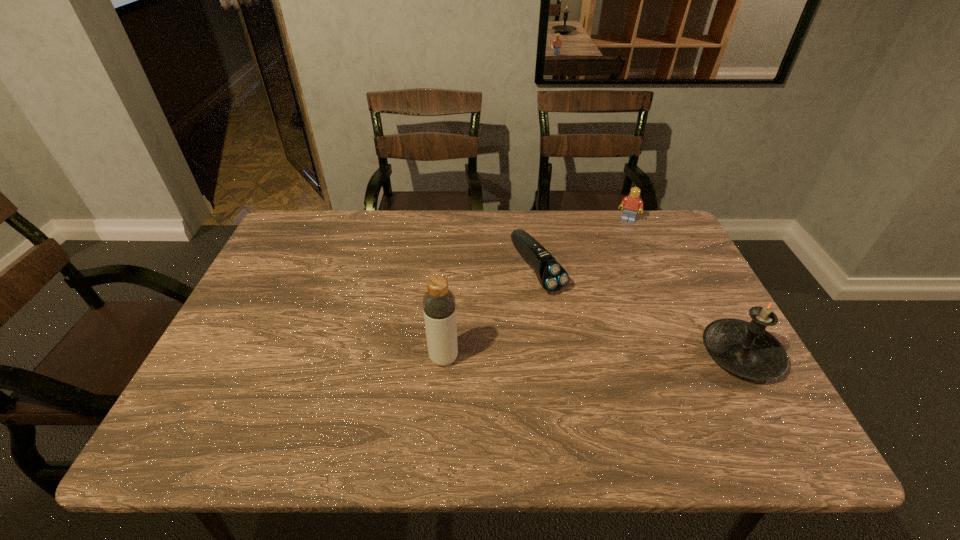
Where is `free space on the desktop that is between the bottle and the third shortest object and is positioned on the head of the electric shaver`? free space on the desktop that is between the bottle and the third shortest object and is positioned on the head of the electric shaver is located at coordinates (612, 356).

Find the location of a particular element. free spot on the desktop that is between the tallest object and the second tallest object and is positioned on the front-facing side of the second shortest object is located at coordinates (585, 356).